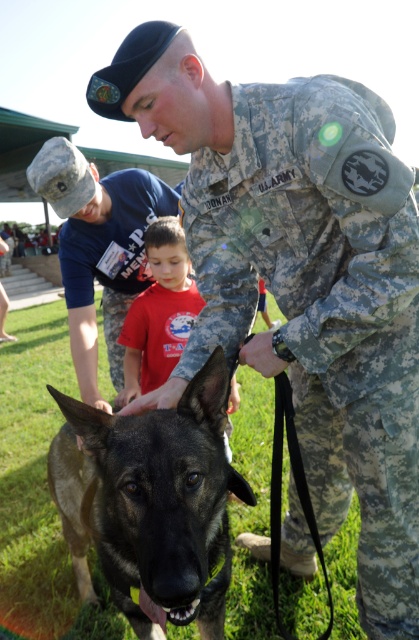
Who is higher up, dark brown fur dog at center or camouflage uniform at center?

Positioned higher is camouflage uniform at center.

Is point (217, 371) less distant than point (93, 252)?

Yes, point (217, 371) is closer to viewer.

The width and height of the screenshot is (419, 640). Find the location of `dark brown fur dog at center`. dark brown fur dog at center is located at coordinates (152, 502).

Is point (219, 472) farther from camera compared to point (139, 355)?

No, (219, 472) is closer to viewer.

Does dark brown fur dog at center have a larger size compared to red cotton shirt at center?

Yes, dark brown fur dog at center is bigger than red cotton shirt at center.

Who is more forward, (x=124, y=528) or (x=152, y=385)?

Point (x=124, y=528)

Where is `dark brown fur dog at center`? dark brown fur dog at center is located at coordinates (152, 502).

Which of these two, camouflage uniform at center or red cotton shirt at center, stands shorter?

With less height is red cotton shirt at center.

Does camouflage uniform at center have a lesser height compared to red cotton shirt at center?

No.

This screenshot has width=419, height=640. What do you see at coordinates (98, 248) in the screenshot?
I see `camouflage uniform at center` at bounding box center [98, 248].

Where is `camouflage uniform at center`? Image resolution: width=419 pixels, height=640 pixels. camouflage uniform at center is located at coordinates (98, 248).